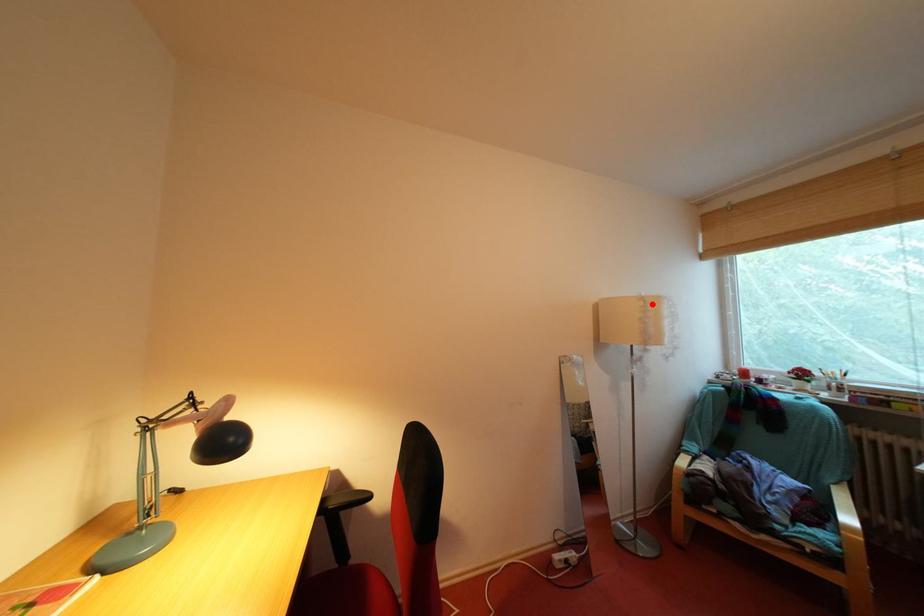
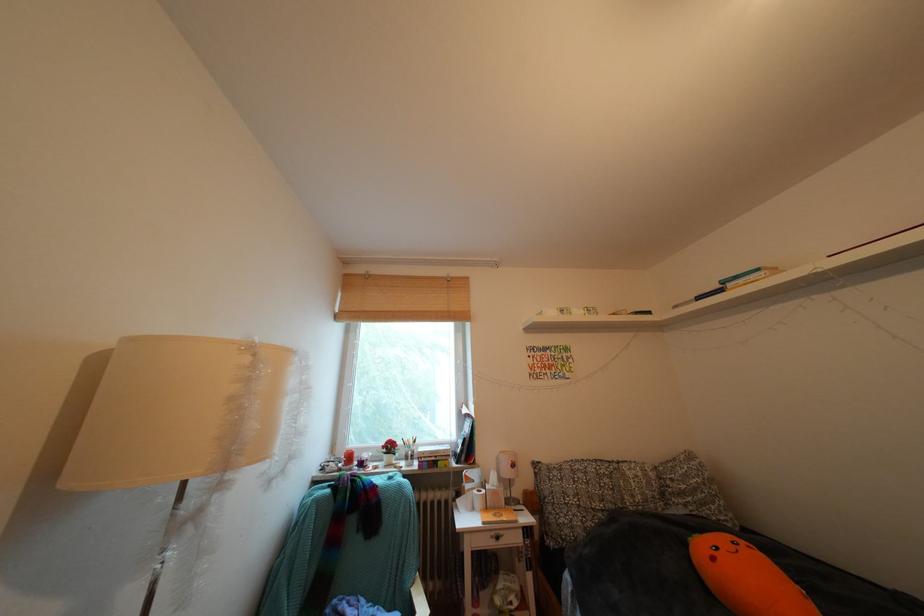
The point at the highlighted location is marked in the first image. Where is the corresponding point in the second image?

(259, 353)